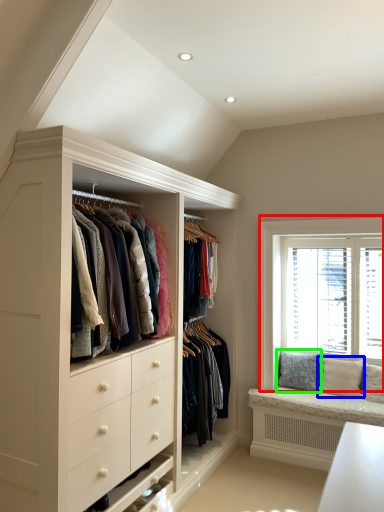
Question: Which is nearer to the window (highlighted by a red box)? pillow (highlighted by a blue box) or pillow (highlighted by a green box).

Choices:
 (A) pillow
 (B) pillow

Answer: (B)